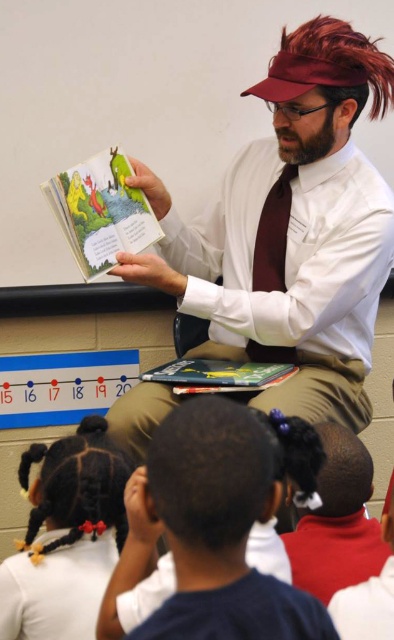
You are a robot with a 24 inch arm reach. You need to grab the hardcover book at center from your current position. Can you reach it if the black hair at lower center is blocking your path?

The distance between the black hair at lower center and the hardcover book at center is 27.53 inches. Since your arm can reach 24 inches, you cannot reach the hardcover book at center because the black hair at lower center is blocking the path and the distance is greater than your reach.

You are a child sitting at point (211, 384) and want to move closer to the storybook being read. The storyteller is at point (178, 416). Can you walk directly towards the storyteller to get a better view?

Yes, because point (178, 416) is in front of point (211, 384), so walking directly towards the storyteller at point (178, 416) would bring you closer to the storybook.